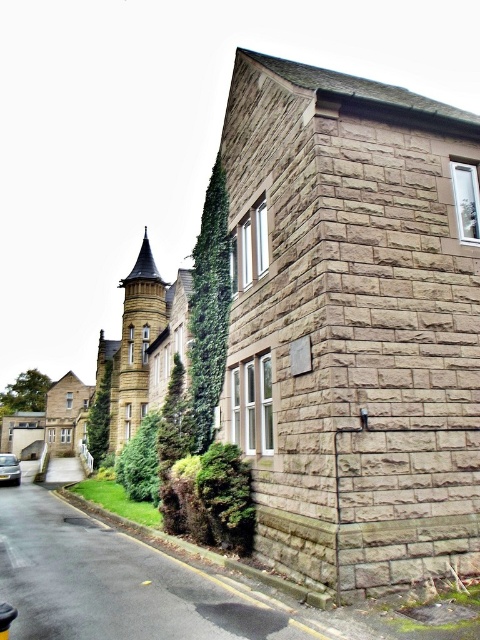
Question: Is green leafy ivy at lower left thinner than green leafy ivy at center?

Choices:
 (A) yes
 (B) no

Answer: (B)

Question: Is green leafy ivy at lower left positioned at the back of silver metallic car at lower left?

Choices:
 (A) no
 (B) yes

Answer: (A)

Question: Among these objects, which one is farthest from the camera?

Choices:
 (A) green leafy ivy at lower left
 (B) green leafy ivy at center

Answer: (A)

Question: Is green ivy at left below silver metallic car at lower left?

Choices:
 (A) yes
 (B) no

Answer: (B)

Question: Among these objects, which one is farthest from the camera?

Choices:
 (A) green ivy at left
 (B) green ivy at center
 (C) silver metallic car at lower left

Answer: (A)

Question: Which object is farther from the camera taking this photo?

Choices:
 (A) green ivy at left
 (B) silver metallic car at lower left
 (C) green leafy ivy at lower left

Answer: (A)